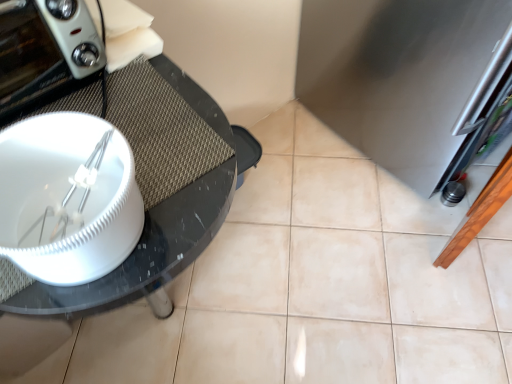
Identify the location of free space to the left of stainless steel refrigerator at right. This screenshot has width=512, height=384. (295, 163).